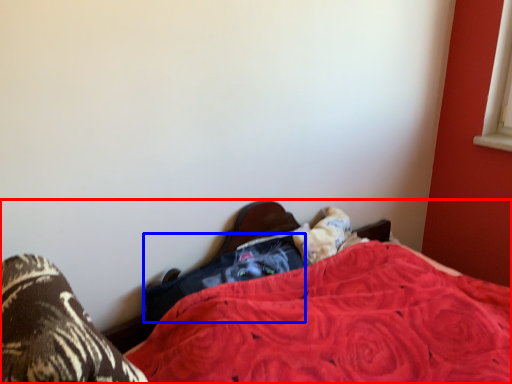
Question: Which object is closer to the camera taking this photo, bed (highlighted by a red box) or clothing (highlighted by a blue box)?

Choices:
 (A) bed
 (B) clothing

Answer: (A)